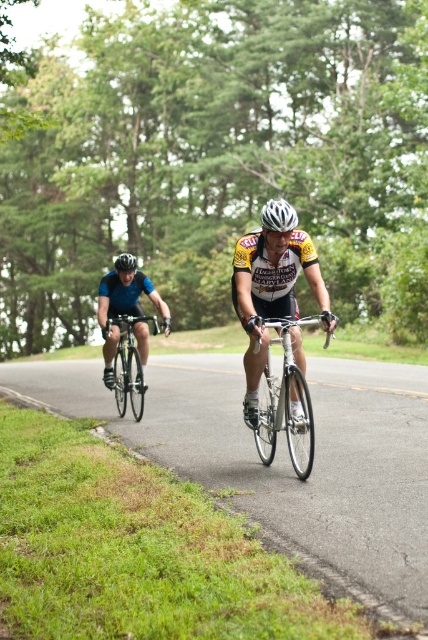
Question: Estimate the real-world distances between objects in this image. Which object is farther from the matte blue jersey at left?

Choices:
 (A) silver metallic bicycle at center
 (B) white matte bicycle helmet at center
 (C) shiny silver bicycle at left
 (D) black matte helmet at upper center

Answer: (A)

Question: Which point is farther from the camera taking this photo?

Choices:
 (A) (273, 412)
 (B) (119, 260)

Answer: (B)

Question: Which point is farther to the camera?

Choices:
 (A) shiny silver bicycle at left
 (B) silver metallic bicycle at center

Answer: (A)

Question: Can you confirm if silver metallic bicycle at center is bigger than matte blue jersey at left?

Choices:
 (A) yes
 (B) no

Answer: (B)

Question: Does silver metallic bicycle at center lie behind matte blue jersey at left?

Choices:
 (A) no
 (B) yes

Answer: (A)

Question: Is shiny silver bicycle at left bigger than white matte bicycle helmet at center?

Choices:
 (A) no
 (B) yes

Answer: (B)